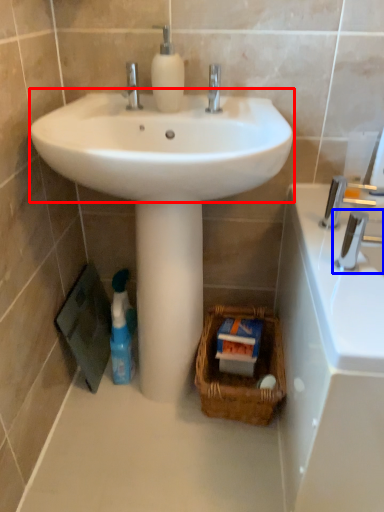
Question: Which object is closer to the camera taking this photo, sink (highlighted by a red box) or tap (highlighted by a blue box)?

Choices:
 (A) sink
 (B) tap

Answer: (A)